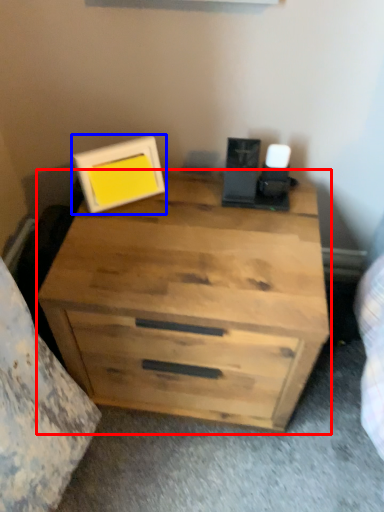
Question: Which object appears farthest to the camera in this image, chest of drawers (highlighted by a red box) or picture frame (highlighted by a blue box)?

Choices:
 (A) chest of drawers
 (B) picture frame

Answer: (B)